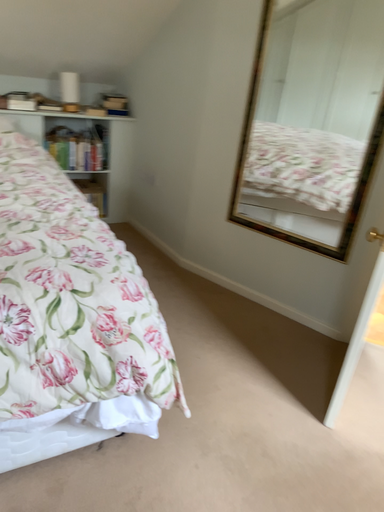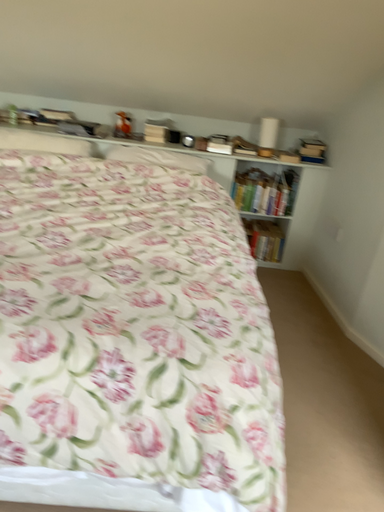
Question: How did the camera likely rotate when shooting the video?

Choices:
 (A) rotated upward
 (B) rotated downward

Answer: (A)